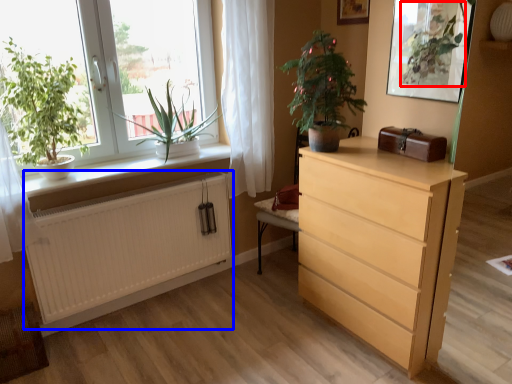
Question: Among these objects, which one is farthest to the camera, vegetation (highlighted by a red box) or radiator (highlighted by a blue box)?

Choices:
 (A) vegetation
 (B) radiator

Answer: (B)